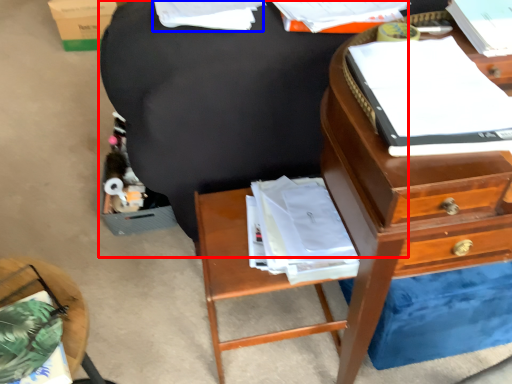
Question: Which object is closer to the camera taking this photo, bean bag chair (highlighted by a red box) or book (highlighted by a blue box)?

Choices:
 (A) bean bag chair
 (B) book

Answer: (B)